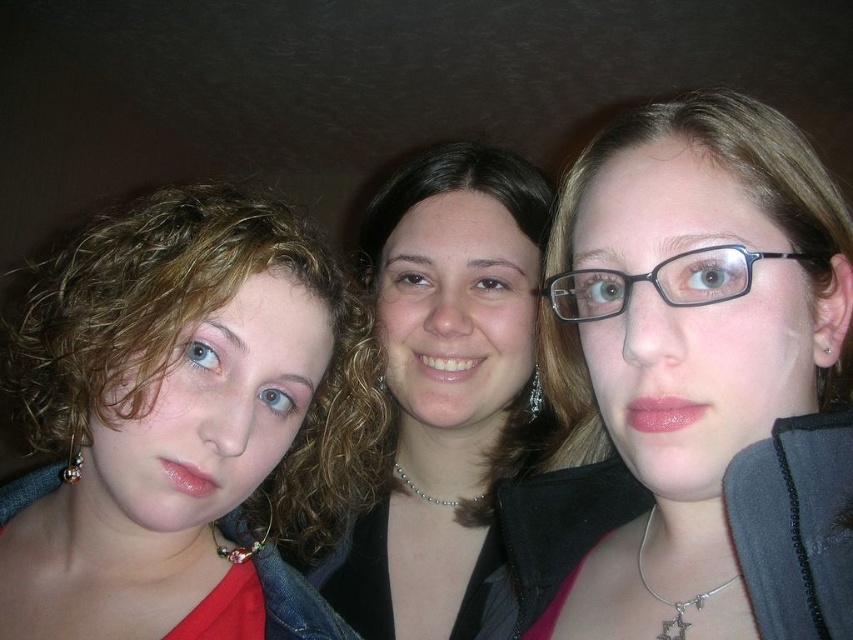
Does matte red shirt at left have a smaller size compared to black plastic glasses at center?

Actually, matte red shirt at left might be larger than black plastic glasses at center.

Who is more forward, (328, 390) or (583, 285)?

Point (583, 285)

Between point (160, 237) and point (659, 262), which one is positioned in front?

Point (659, 262) is more forward.

What are the coordinates of `matte red shirt at left` in the screenshot? It's located at (181, 422).

Does matte black glasses at center have a larger size compared to black plastic glasses at center?

Yes, matte black glasses at center is bigger than black plastic glasses at center.

Is point (641, 156) positioned before point (734, 276)?

No.

You are a GUI agent. You are given a task and a screenshot of the screen. Output one action in this format:
    pyautogui.click(x=<x>, y=<y>)
    Task: Click on the matte black glasses at center
    
    Given the screenshot: What is the action you would take?
    pyautogui.click(x=706, y=376)

Can you confirm if matte red shirt at left is smaller than smooth black jacket at center?

No.

Is matte red shirt at left to the left of smooth black jacket at center from the viewer's perspective?

Yes, matte red shirt at left is to the left of smooth black jacket at center.

Between point (126, 552) and point (593, 522), which one is positioned in front?

Positioned in front is point (593, 522).

Image resolution: width=853 pixels, height=640 pixels. What are the coordinates of `matte red shirt at left` in the screenshot? It's located at point(181,422).